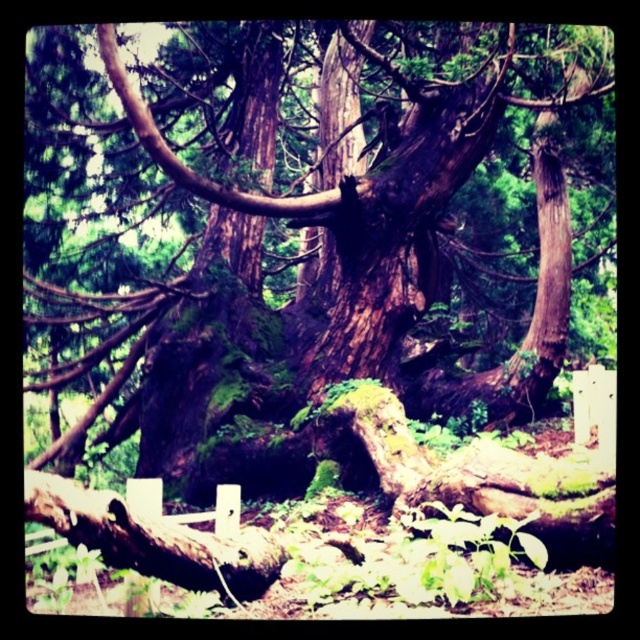
Is the position of dark brown bark tree at center more distant than that of brown rough tree trunk at center?

No, it is in front of brown rough tree trunk at center.

Between dark brown bark tree at center and brown rough tree trunk at center, which one is positioned higher?

dark brown bark tree at center is above.

Does point (294, 28) come behind point (536, 348)?

Yes, it is behind point (536, 348).

I want to click on dark brown bark tree at center, so click(320, 234).